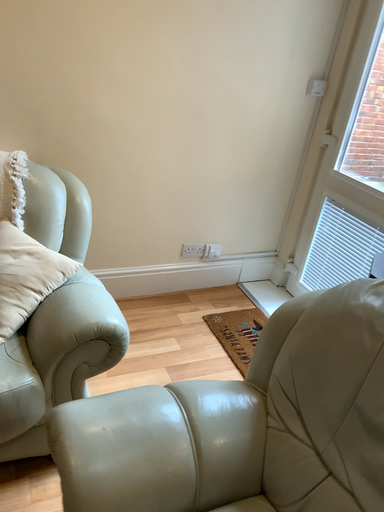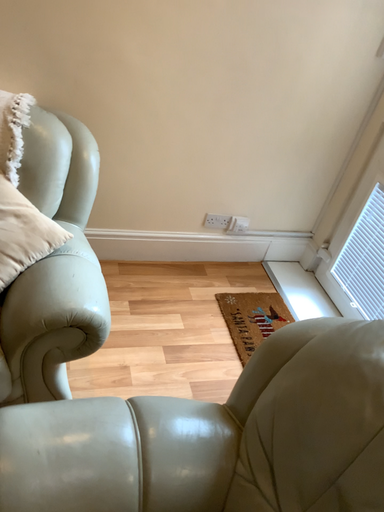
Question: Which way did the camera rotate in the video?

Choices:
 (A) rotated left
 (B) rotated right

Answer: (A)